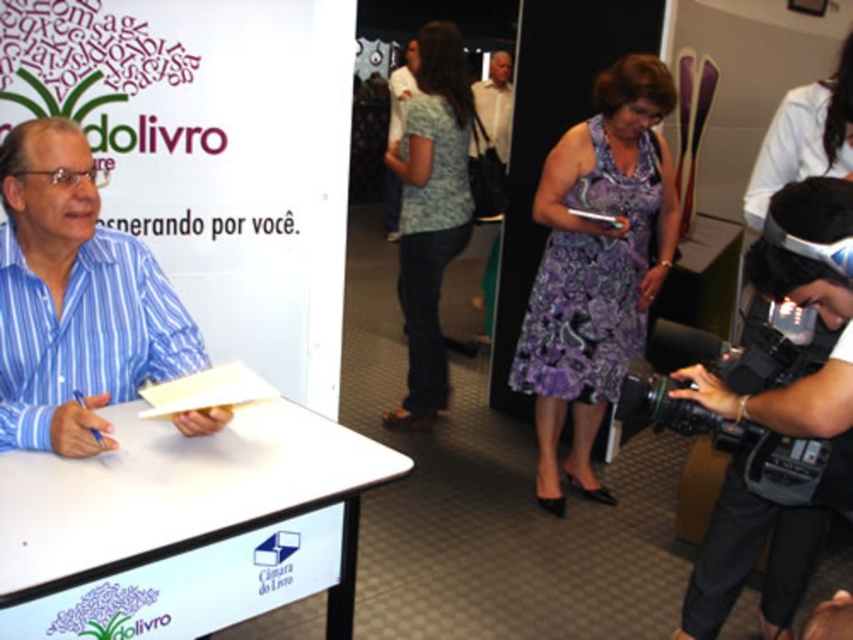
You are a photographer at the book signing event. You need to capture a photo of the purple printed dress at center and the black plastic video camera at lower right in the same frame. Which object should you position closer to the camera to ensure both fit in the frame?

The purple printed dress at center is wider than the black plastic video camera at lower right, so you should position the purple printed dress at center closer to the camera to ensure both fit in the frame.

You are a photographer at the event and need to capture both the purple printed dress at center and the black plastic video camera at lower right in a single frame. Which object should you focus on first to ensure both are in the frame?

The purple printed dress at center is much taller than the black plastic video camera at lower right, so you should focus on the purple printed dress at center first to ensure both objects are in the frame.